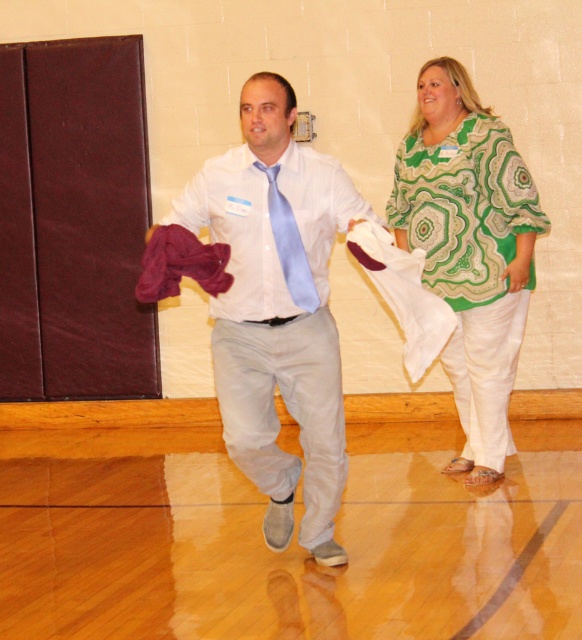
Consider the image. Which of these two, green paisley blouse at right or maroon fabric at center, stands taller?

Standing taller between the two is green paisley blouse at right.

This screenshot has height=640, width=582. Describe the element at coordinates (470, 248) in the screenshot. I see `green paisley blouse at right` at that location.

This screenshot has width=582, height=640. In order to click on green paisley blouse at right in this screenshot , I will do `click(470, 248)`.

Does light gray cotton shirt at center have a lesser height compared to white satin shirt at center?

No.

Who is positioned more to the left, light gray cotton shirt at center or white satin shirt at center?

light gray cotton shirt at center is more to the left.

Locate an element on the screen. This screenshot has height=640, width=582. light gray cotton shirt at center is located at coordinates (278, 308).

Where is `light gray cotton shirt at center`? light gray cotton shirt at center is located at coordinates (278, 308).

Is light gray cotton shirt at center wider than maroon fabric at center?

Yes.

Is light gray cotton shirt at center positioned behind maroon fabric at center?

That is True.

Is point (243, 246) positioned in front of point (222, 291)?

No.

The width and height of the screenshot is (582, 640). I want to click on light gray cotton shirt at center, so click(278, 308).